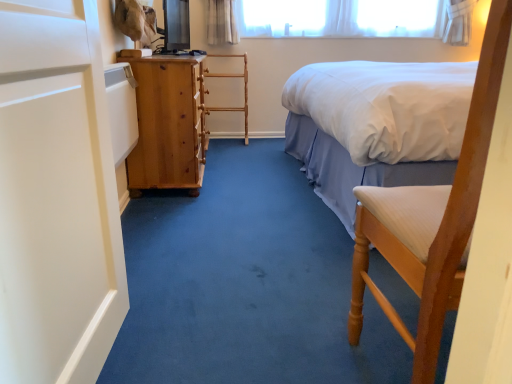
Question: Is wooden rack at center touching wooden chair at right?

Choices:
 (A) yes
 (B) no

Answer: (B)

Question: Is wooden rack at center at the right side of wooden chair at right?

Choices:
 (A) no
 (B) yes

Answer: (A)

Question: Can you confirm if wooden rack at center is taller than wooden chair at right?

Choices:
 (A) yes
 (B) no

Answer: (B)

Question: Is wooden rack at center smaller than wooden chair at right?

Choices:
 (A) no
 (B) yes

Answer: (B)

Question: Is wooden chair at right inside wooden rack at center?

Choices:
 (A) no
 (B) yes

Answer: (A)

Question: From a real-world perspective, is wooden rack at center above or below wooden chair at right?

Choices:
 (A) above
 (B) below

Answer: (B)

Question: Considering the positions of wooden rack at center and wooden chair at right in the image, is wooden rack at center taller or shorter than wooden chair at right?

Choices:
 (A) short
 (B) tall

Answer: (A)

Question: Is point coord(232,107) closer or farther from the camera than point coord(501,64)?

Choices:
 (A) closer
 (B) farther

Answer: (B)

Question: Is wooden rack at center spatially inside wooden chair at right, or outside of it?

Choices:
 (A) inside
 (B) outside

Answer: (B)

Question: Looking at their shapes, would you say wooden chair at right is wider or thinner than white matte screen door at left?

Choices:
 (A) wide
 (B) thin

Answer: (A)

Question: Considering the positions of wooden chair at right and white matte screen door at left in the image, is wooden chair at right taller or shorter than white matte screen door at left?

Choices:
 (A) tall
 (B) short

Answer: (A)

Question: Is wooden chair at right in front of or behind white matte screen door at left in the image?

Choices:
 (A) front
 (B) behind

Answer: (B)

Question: From a real-world perspective, is wooden chair at right above or below white matte screen door at left?

Choices:
 (A) above
 (B) below

Answer: (B)

Question: From a real-world perspective, is white cotton bed at upper right physically located above or below white matte screen door at left?

Choices:
 (A) above
 (B) below

Answer: (A)

Question: Is white cotton bed at upper right inside the boundaries of white matte screen door at left, or outside?

Choices:
 (A) outside
 (B) inside

Answer: (A)